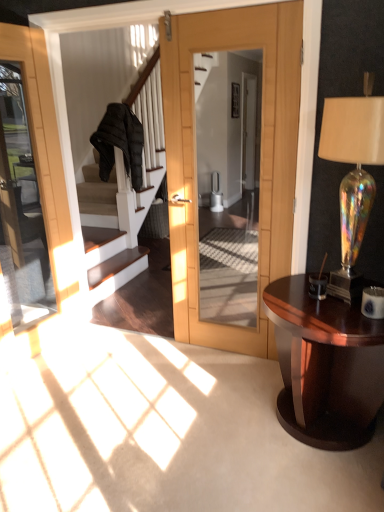
Question: Is glossy wood table at lower right taller or shorter than iridescent glass lamp at right?

Choices:
 (A) tall
 (B) short

Answer: (B)

Question: In terms of size, does glossy wood table at lower right appear bigger or smaller than iridescent glass lamp at right?

Choices:
 (A) big
 (B) small

Answer: (A)

Question: Considering the positions of point (279, 287) and point (345, 273), is point (279, 287) closer or farther from the camera than point (345, 273)?

Choices:
 (A) closer
 (B) farther

Answer: (B)

Question: From their relative heights in the image, would you say iridescent glass lamp at right is taller or shorter than glossy wood table at lower right?

Choices:
 (A) tall
 (B) short

Answer: (A)

Question: Relative to glossy wood table at lower right, is iridescent glass lamp at right in front or behind?

Choices:
 (A) behind
 (B) front

Answer: (B)

Question: From the image's perspective, is iridescent glass lamp at right located above or below glossy wood table at lower right?

Choices:
 (A) below
 (B) above

Answer: (B)

Question: Considering the positions of iridescent glass lamp at right and glossy wood table at lower right in the image, is iridescent glass lamp at right bigger or smaller than glossy wood table at lower right?

Choices:
 (A) small
 (B) big

Answer: (A)